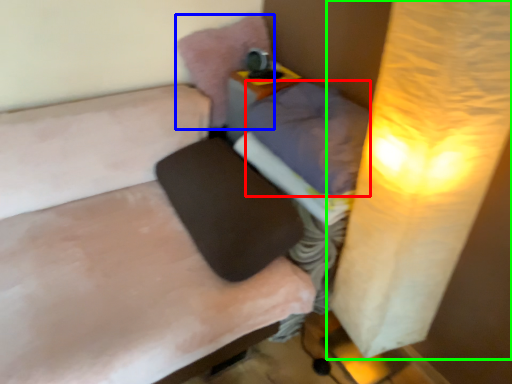
Question: Which is nearer to the pillow (highlighted by a red box)? pillow (highlighted by a blue box) or lamp (highlighted by a green box).

Choices:
 (A) pillow
 (B) lamp

Answer: (B)